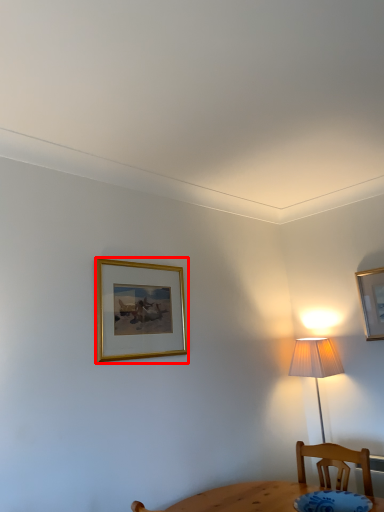
Question: From the image's perspective, what is the correct spatial relationship of picture frame (annotated by the red box) in relation to picture frame?

Choices:
 (A) below
 (B) above

Answer: (B)